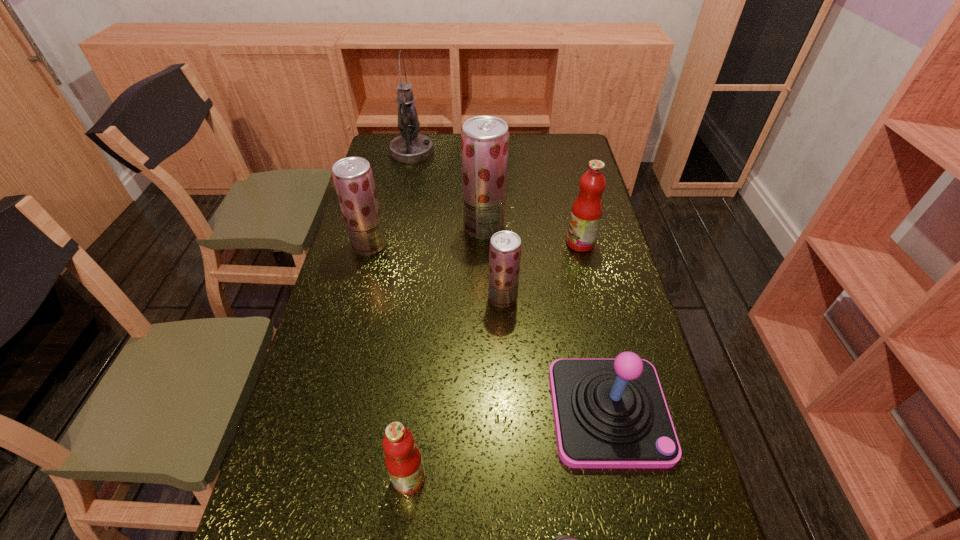
This screenshot has width=960, height=540. Find the location of `joystick`. joystick is located at coordinates (609, 413).

Identify the location of vacant region located 0.170m on the right of the oil lamp. The image size is (960, 540). (474, 152).

Where is `vacant space situated on the right of the biggest strawberry fruit juice`? Image resolution: width=960 pixels, height=540 pixels. vacant space situated on the right of the biggest strawberry fruit juice is located at coordinates (564, 227).

Where is `blank space located on the front of the second biggest strawberry fruit juice`? The height and width of the screenshot is (540, 960). blank space located on the front of the second biggest strawberry fruit juice is located at coordinates (341, 354).

Identify the location of free region located on the front label of the farther pink fruit juice. The width and height of the screenshot is (960, 540). (488, 243).

The image size is (960, 540). I want to click on free region located on the front label of the farther pink fruit juice, so click(512, 243).

You are a GUI agent. You are given a task and a screenshot of the screen. Output one action in this format:
    pyautogui.click(x=<x>, y=<y>)
    Task: Click on the free region located 0.280m on the front label of the farther pink fruit juice
    This screenshot has height=540, width=960.
    Given the screenshot: What is the action you would take?
    pyautogui.click(x=481, y=243)

The width and height of the screenshot is (960, 540). In order to click on vacant space located on the back of the fourth nearest object in this screenshot , I will do `click(499, 222)`.

This screenshot has width=960, height=540. In order to click on free space located on the front label of the smaller pink fruit juice in this screenshot , I will do (x=459, y=478).

This screenshot has width=960, height=540. I want to click on free space located 0.070m forward from the base of the joystick, so click(629, 503).